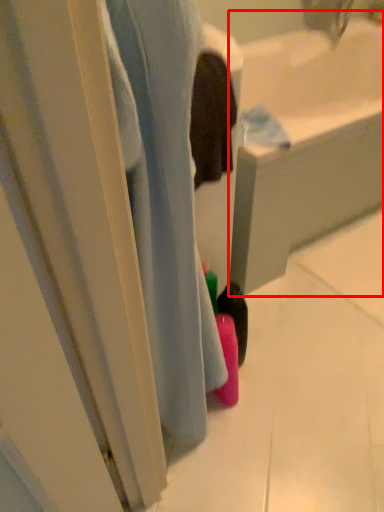
Question: From the image's perspective, where is bath (annotated by the red box) located in relation to bath in the image?

Choices:
 (A) above
 (B) below

Answer: (A)